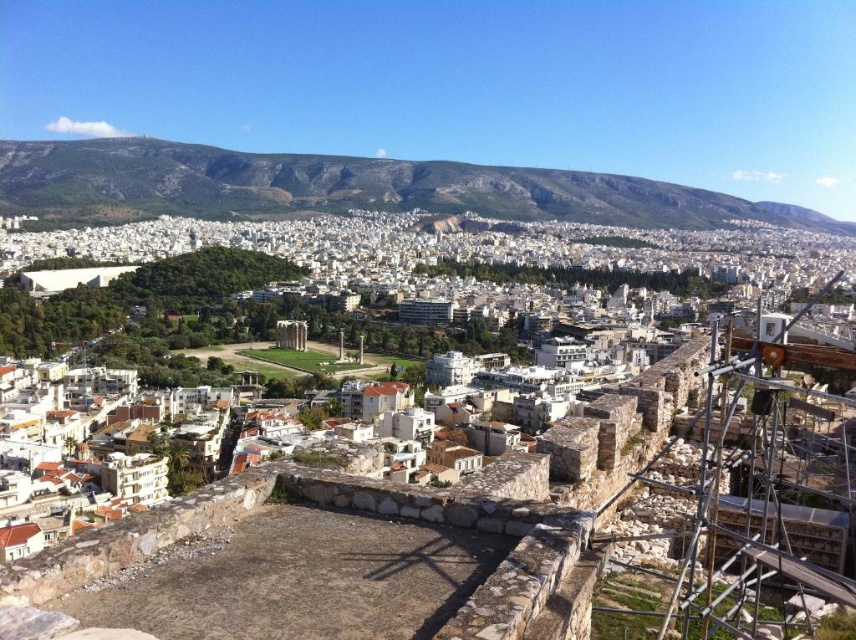
What are the coordinates of the brown stone wall at center?

The coordinates of the brown stone wall at center are (449, 506).

You are a tourist standing in front of the brown stone wall at center and the rocky brown mountain at upper center. Which object is closer to you?

The brown stone wall at center is closer to you as it is positioned in front of the rocky brown mountain at upper center.

You are standing in the city and want to take a photo of the ancient stone wall with scaffolding in the foreground. You notice two points marked in the image. One is at point (853, 436) and the other is at point (180, 156). Which point is better to focus on to ensure the stone wall is sharply in focus?

Point (853, 436) is closer to the viewer than point (180, 156), so focusing on point (853, 436) will ensure the stone wall is in sharp focus.